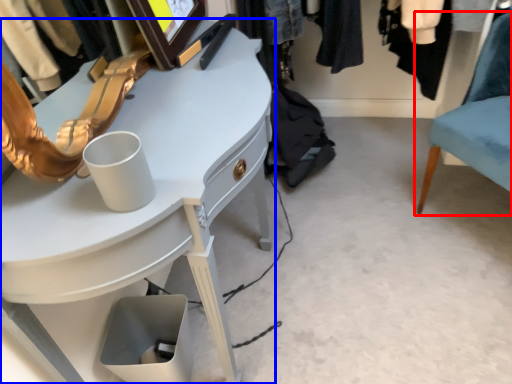
Question: Which object appears farthest to the camera in this image, chair (highlighted by a red box) or desk (highlighted by a blue box)?

Choices:
 (A) chair
 (B) desk

Answer: (A)